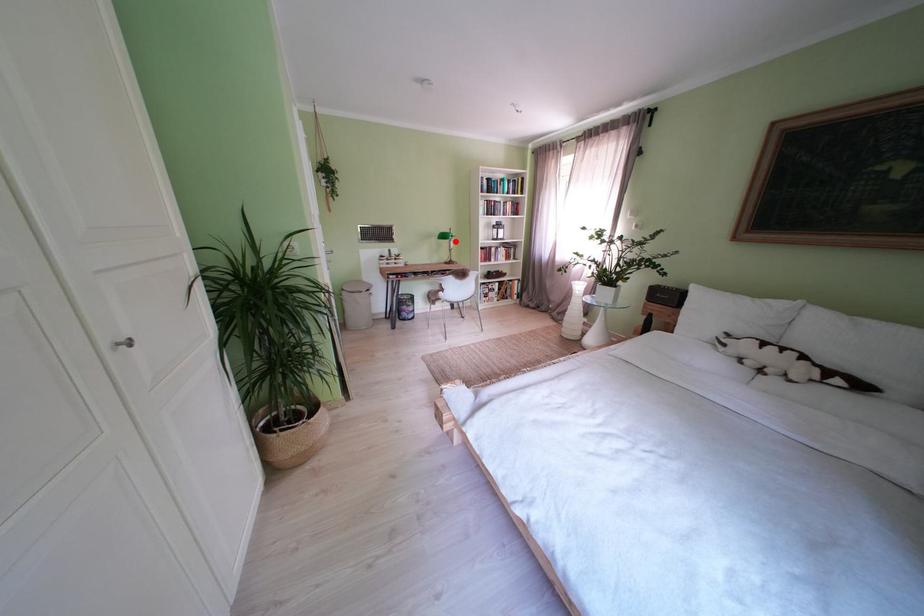
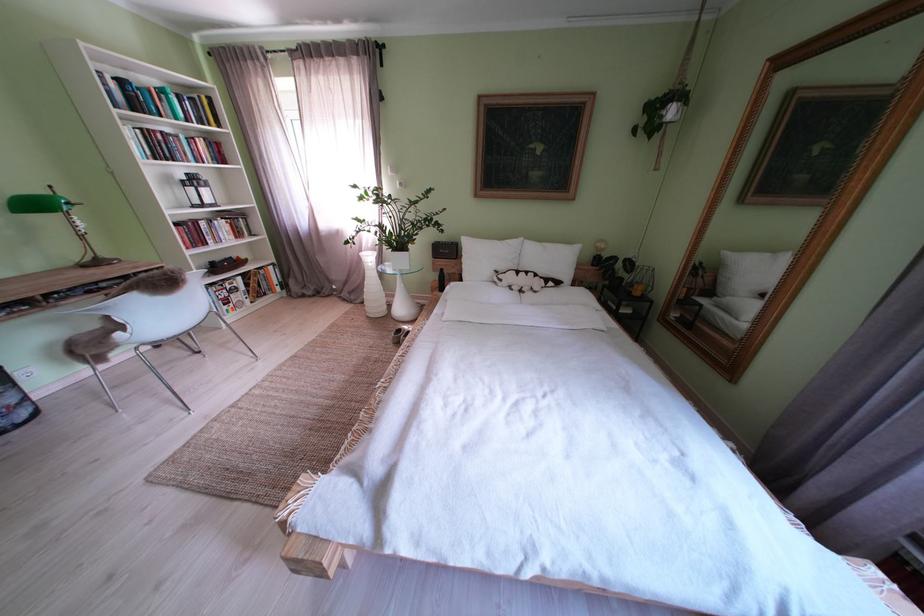
Question: I am providing you with two images of the same scene from different viewpoints. Given a red point in image1, look at the same physical point in image2. Is it:

Choices:
 (A) Closer to the viewpoint
 (B) Farther from the viewpoint

Answer: (B)